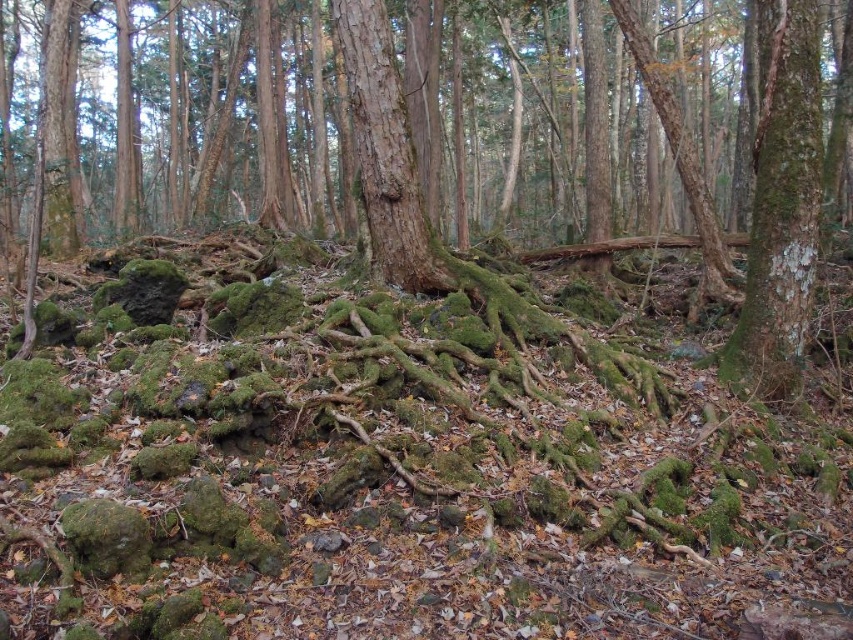
You are a hiker trying to navigate through the forest. You notice two tree trunks ahead of you, the green mossy bark tree trunk at right and the brown rough tree trunk at center. Which tree trunk would you choose to pass by if you want to avoid obstacles around the larger one?

You should avoid the green mossy bark tree trunk at right because it has a larger size compared to the brown rough tree trunk at center, making it more likely to have obstacles around it.

You are a hiker trying to navigate through the forest. You need to pass between the green mossy bark tree trunk at right and the brown rough tree trunk at center. Can you fit through the space between them if you are 1.2 meters wide?

The green mossy bark tree trunk at right is narrower than the brown rough tree trunk at center. However, the exact width between them isn not specified, so it is uncertain if the 1.2 meters width can fit through. More information is needed.